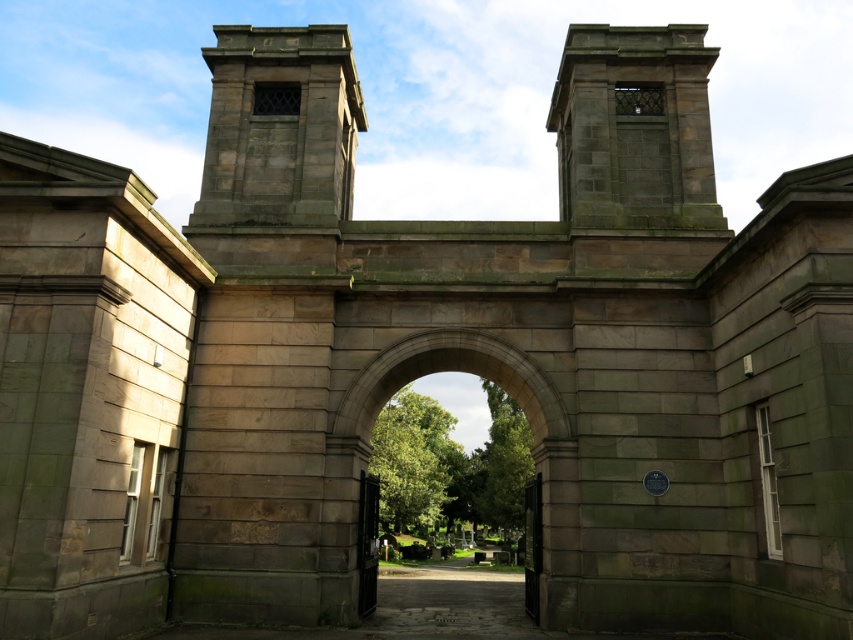
Question: Can you confirm if stone archway at center is thinner than polished dark wood gate at center?

Choices:
 (A) yes
 (B) no

Answer: (B)

Question: Is polished dark wood gate at center to the right of polished dark green gate at center from the viewer's perspective?

Choices:
 (A) no
 (B) yes

Answer: (A)

Question: Which object is closer to the camera taking this photo?

Choices:
 (A) polished dark wood gate at center
 (B) stone archway at center

Answer: (B)

Question: Which of the following is the farthest from the observer?

Choices:
 (A) (367, 518)
 (B) (569, 588)

Answer: (A)

Question: Does polished dark wood gate at center appear on the left side of polished dark green gate at center?

Choices:
 (A) no
 (B) yes

Answer: (B)

Question: Which object is closer to the camera taking this photo?

Choices:
 (A) polished dark wood gate at center
 (B) stone archway at center

Answer: (B)